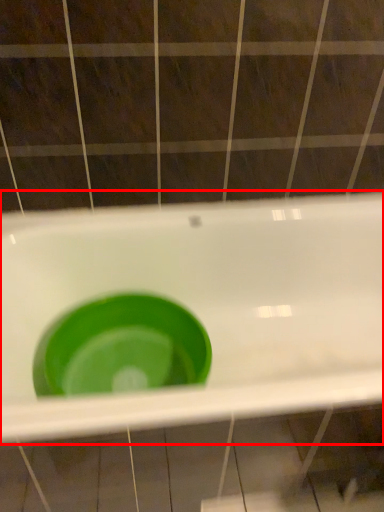
Question: From the image's perspective, what is the correct spatial positioning of sink (annotated by the red box) in reference to basin?

Choices:
 (A) above
 (B) below

Answer: (B)